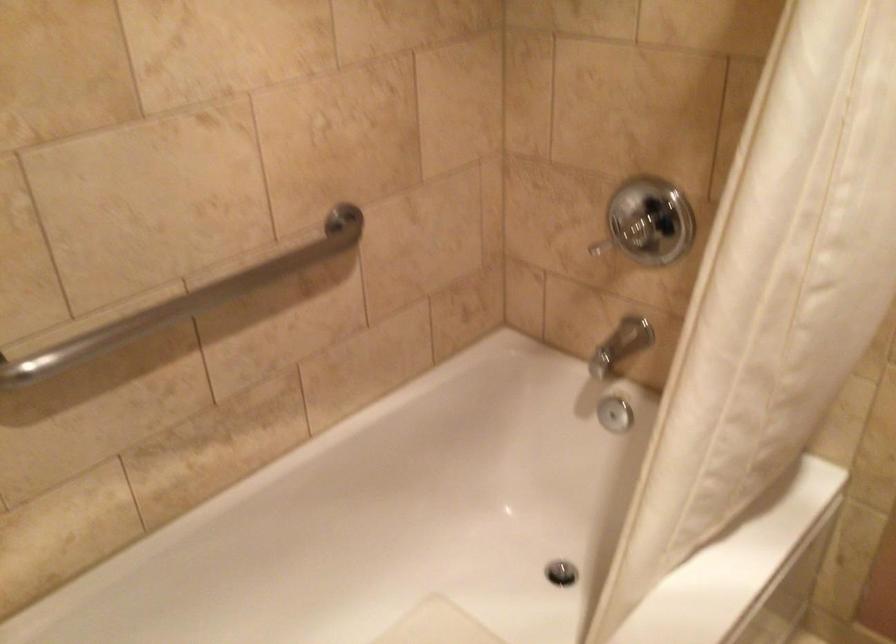
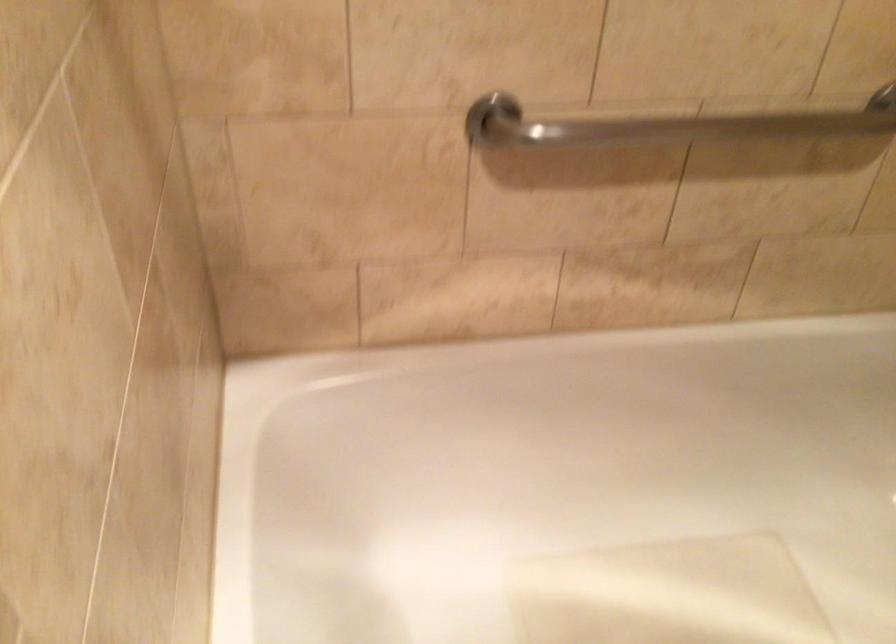
Find the pixel in the second image that matches [165,310] in the first image.

(668, 124)